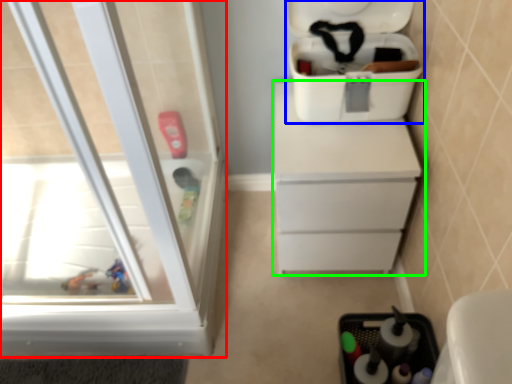
Question: Considering the real-world distances, which object is closest to screen door (highlighted by a red box)? cooler (highlighted by a blue box) or chest of drawers (highlighted by a green box).

Choices:
 (A) cooler
 (B) chest of drawers

Answer: (B)